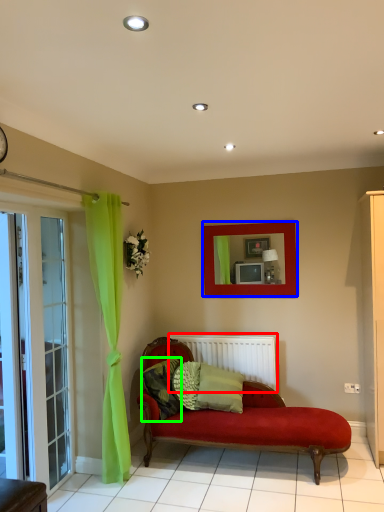
Question: Which object is the closest to the radiator (highlighted by a red box)? Choose among these: picture frame (highlighted by a blue box) or pillow (highlighted by a green box).

Choices:
 (A) picture frame
 (B) pillow

Answer: (B)